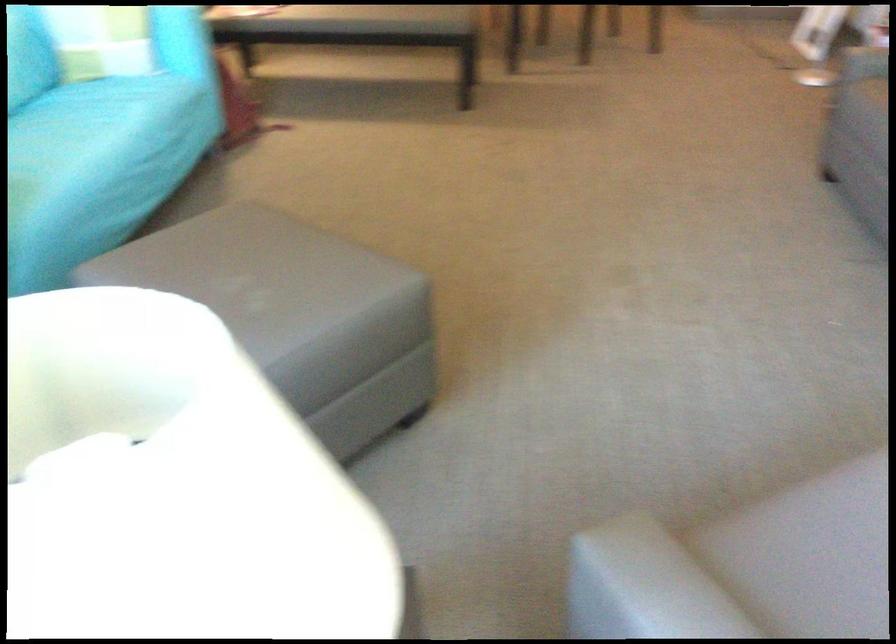
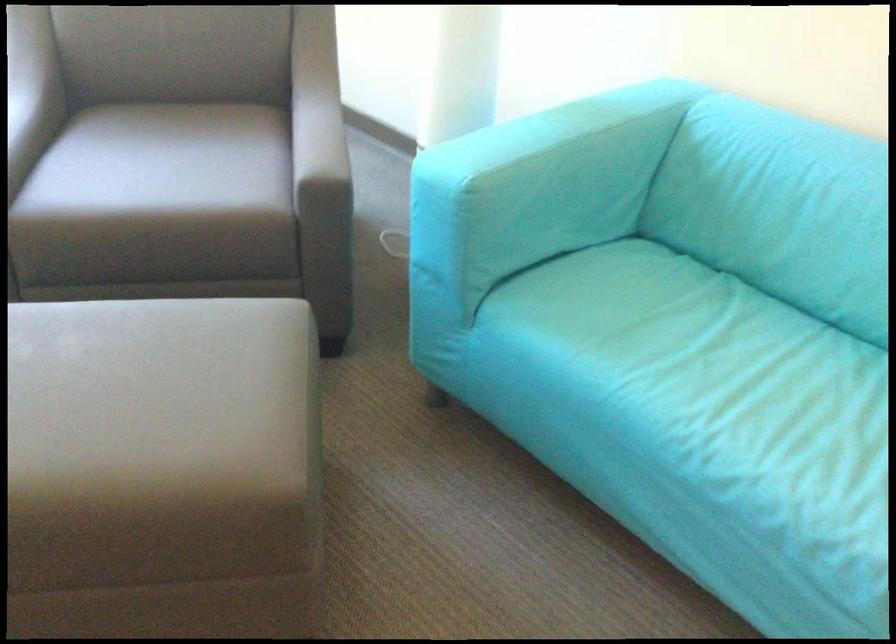
Locate, in the second image, the point that corresponds to the point at 280,219 in the first image.

(162, 469)